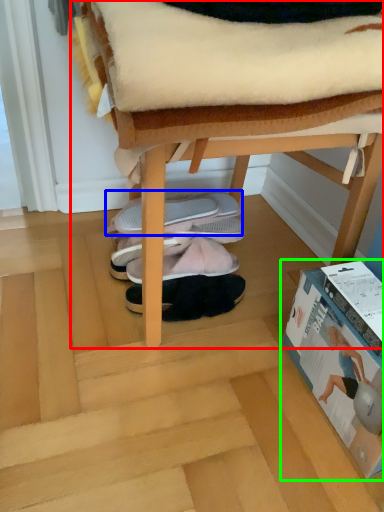
Question: Considering the real-world distances, which object is closest to furniture (highlighted by a red box)? footwear (highlighted by a blue box) or paperback book (highlighted by a green box).

Choices:
 (A) footwear
 (B) paperback book

Answer: (B)